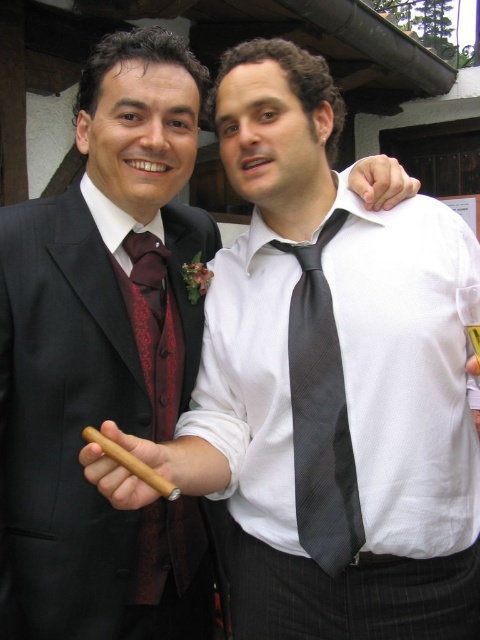
Consider the image. Is black satin suit at left bigger than matte burgundy tie at center?

Correct, black satin suit at left is larger in size than matte burgundy tie at center.

Who is higher up, black satin suit at left or matte burgundy tie at center?

Positioned higher is matte burgundy tie at center.

What do you see at coordinates (60, 424) in the screenshot? I see `black satin suit at left` at bounding box center [60, 424].

Identify the location of black satin suit at left. click(60, 424).

Is dark gray textured tie at center to the left of matte burgundy tie at center from the viewer's perspective?

No, dark gray textured tie at center is not to the left of matte burgundy tie at center.

Is point (294, 296) closer to camera compared to point (162, 305)?

Yes, it is in front of point (162, 305).

I want to click on dark gray textured tie at center, so click(x=321, y=413).

Between black satin suit at left and dark gray textured tie at center, which one appears on the left side from the viewer's perspective?

Positioned to the left is black satin suit at left.

Who is shorter, black satin suit at left or dark gray textured tie at center?

dark gray textured tie at center

Between point (48, 227) and point (305, 320), which one is positioned behind?

The point (305, 320) is behind.

Locate an element on the screen. black satin suit at left is located at coordinates point(60,424).